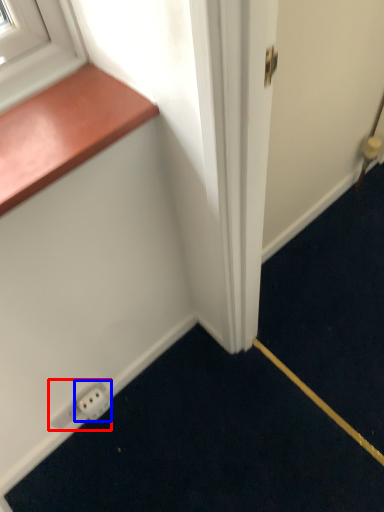
Question: Which object appears farthest to the camera in this image, electric outlet (highlighted by a red box) or electric outlet (highlighted by a blue box)?

Choices:
 (A) electric outlet
 (B) electric outlet

Answer: (A)